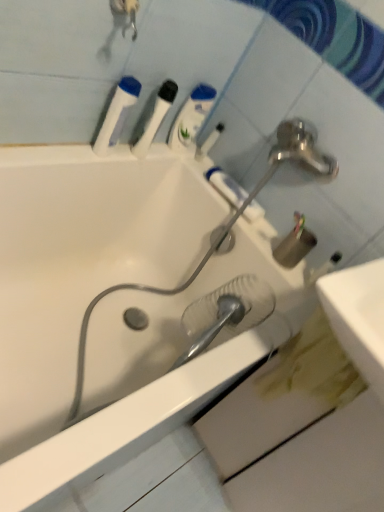
This screenshot has width=384, height=512. I want to click on vacant area in front of white plastic toothbrush at upper center, so click(190, 167).